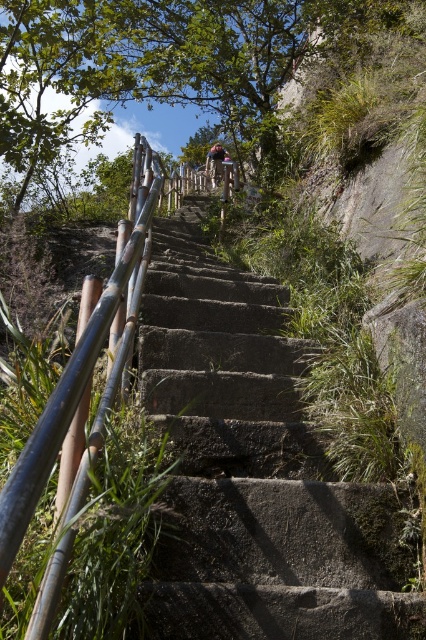
Can you confirm if dark gray concrete stairs at center is thinner than brown bamboo rail at left?

Incorrect, dark gray concrete stairs at center's width is not less than brown bamboo rail at left's.

Consider the image. Who is lower down, dark gray concrete stairs at center or brown bamboo rail at left?

Positioned lower is dark gray concrete stairs at center.

Is point (219, 316) more distant than point (86, 490)?

Yes, it is behind point (86, 490).

Identify the location of dark gray concrete stairs at center. 253,468.

Is point (118, 369) closer to camera compared to point (209, 172)?

Yes, point (118, 369) is in front of point (209, 172).

Is brown bamboo rail at left positioned behind blue denim jeans at center?

No.

Locate an element on the screen. brown bamboo rail at left is located at coordinates (80, 403).

Where is `brown bamboo rail at left`? This screenshot has width=426, height=640. brown bamboo rail at left is located at coordinates (80, 403).

Measure the distance between dark gray concrete stairs at center and blue denim jeans at center.

dark gray concrete stairs at center and blue denim jeans at center are 39.65 feet apart from each other.

Consider the image. Does dark gray concrete stairs at center appear on the left side of blue denim jeans at center?

No, dark gray concrete stairs at center is not to the left of blue denim jeans at center.

Is point (160, 253) positioned before point (221, 152)?

Yes, point (160, 253) is closer to viewer.

At what (x,y) coordinates should I click in order to perform the action: click on dark gray concrete stairs at center. Please return your answer as a coordinate pair (x, y). The image size is (426, 640). Looking at the image, I should click on (253, 468).